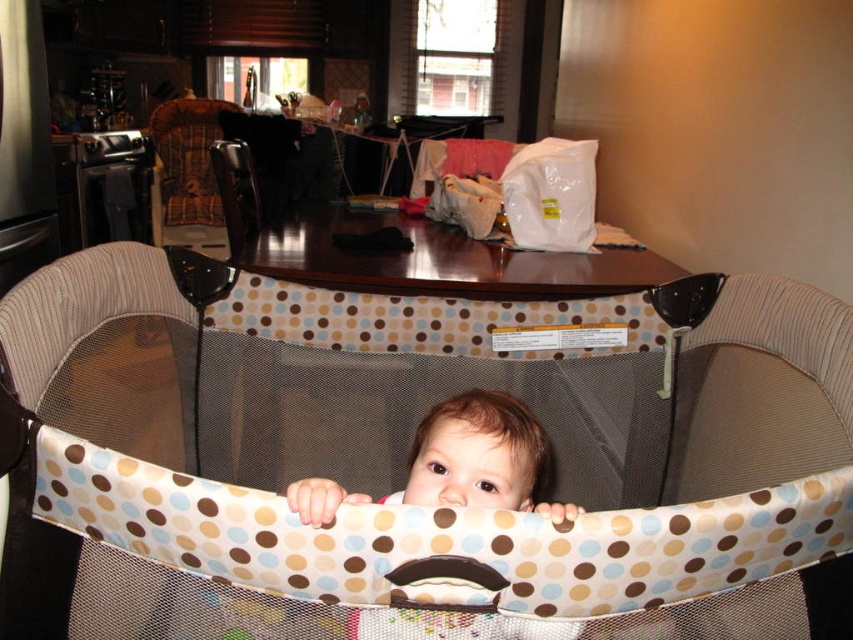
You are a parent trying to place a toy for your baby. The toy needs to be placed within 3 meters of the plaid fabric feeding chair at upper left so the baby can reach it. Is the brown fabric baby at center within that distance?

The brown fabric baby at center is 3.43 meters away from the plaid fabric feeding chair at upper left. Since the required distance is 3 meters, the baby is slightly out of reach.

You are a parent trying to place a new toy in the play area. The toy needs to be placed between the brown dotted fabric playpen at center and the plaid fabric feeding chair at upper left. Where should you place the toy?

The toy should be placed between the brown dotted fabric playpen at center and the plaid fabric feeding chair at upper left, as the playpen is in front of the feeding chair, so the space between them is directly in front of the feeding chair and behind the playpen.